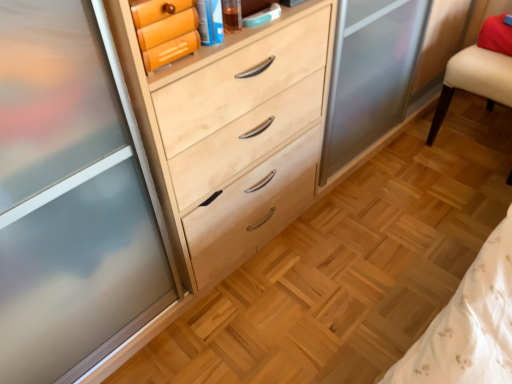
Locate an element on the screen. This screenshot has width=512, height=384. free point below beige fabric chair at right (from a real-world perspective) is located at coordinates (481, 139).